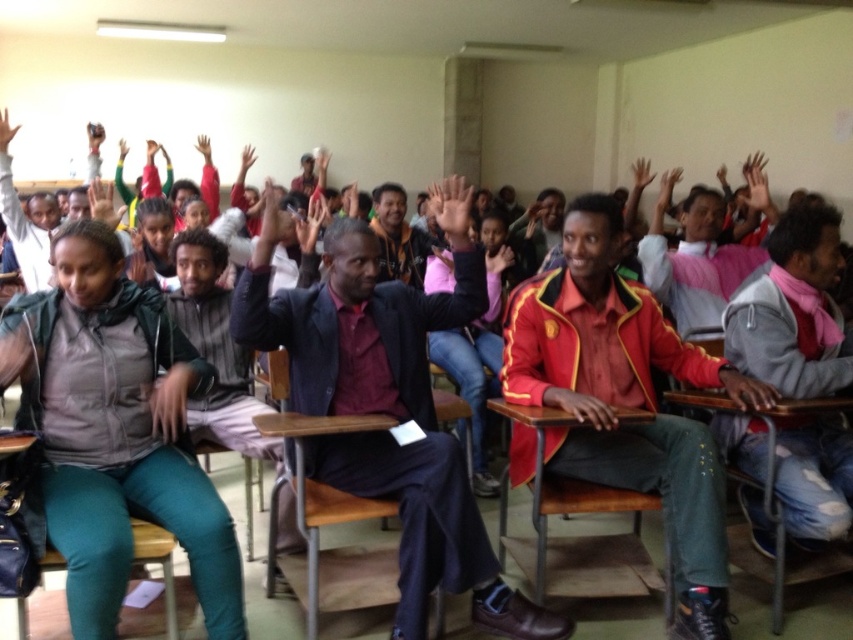
Question: Among these points, which one is farthest from the camera?

Choices:
 (A) (672, 508)
 (B) (370, 304)

Answer: (B)

Question: Can you confirm if maroon fabric shirt at center is bigger than red leather jacket at center?

Choices:
 (A) no
 (B) yes

Answer: (B)

Question: In this image, where is maroon fabric shirt at center located relative to red leather jacket at center?

Choices:
 (A) right
 (B) left

Answer: (B)

Question: Is maroon fabric shirt at center positioned in front of red leather jacket at center?

Choices:
 (A) yes
 (B) no

Answer: (A)

Question: Which of the following is the farthest from the observer?

Choices:
 (A) red leather jacket at center
 (B) maroon fabric shirt at center

Answer: (A)

Question: Which point is closer to the camera?

Choices:
 (A) maroon fabric shirt at center
 (B) red leather jacket at center

Answer: (A)